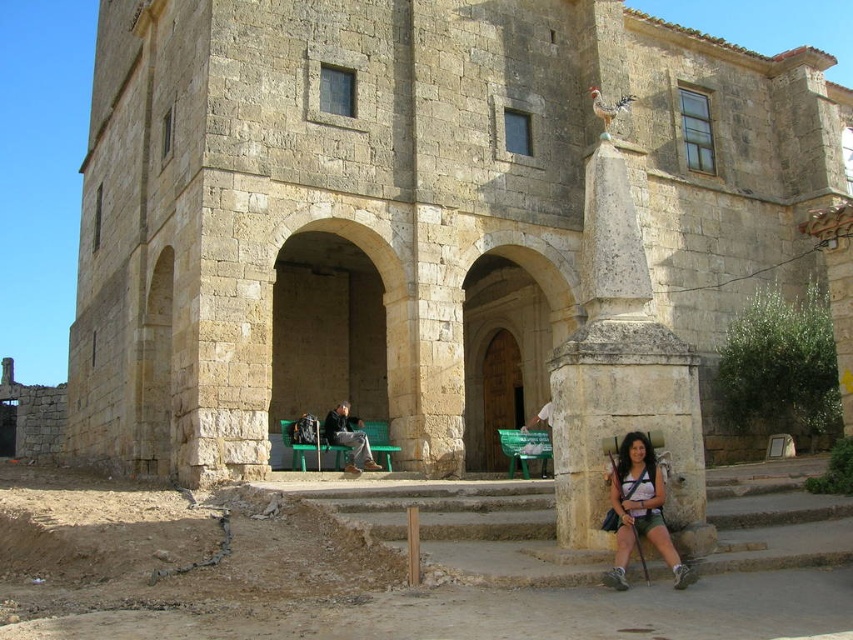
Question: Which point appears closest to the camera in this image?

Choices:
 (A) (679, 499)
 (B) (608, 506)

Answer: (A)

Question: In this image, where is matte white shirt at lower right located relative to dark brown leather jacket at center?

Choices:
 (A) above
 (B) below

Answer: (A)

Question: Can you confirm if stone column at center is positioned above matte white shirt at lower right?

Choices:
 (A) no
 (B) yes

Answer: (B)

Question: Which object appears closest to the camera in this image?

Choices:
 (A) stone column at center
 (B) dark brown leather jacket at center
 (C) matte white shirt at lower right

Answer: (C)

Question: Which point appears farthest from the camera in this image?

Choices:
 (A) (566, 529)
 (B) (343, 435)

Answer: (B)

Question: Is the position of matte white shirt at lower right more distant than that of dark brown leather jacket at center?

Choices:
 (A) no
 (B) yes

Answer: (A)